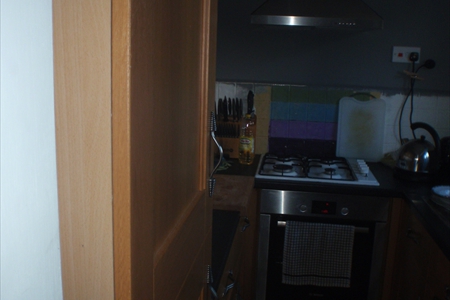
This screenshot has height=300, width=450. In order to click on stove knob in this screenshot , I will do `click(344, 212)`, `click(302, 208)`.